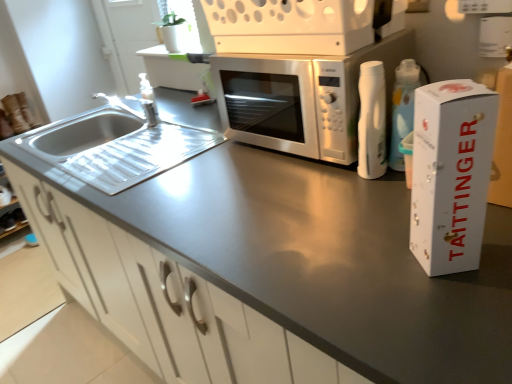
You are a GUI agent. You are given a task and a screenshot of the screen. Output one action in this format:
    pyautogui.click(x=<x>, y=<y>)
    Task: Click on the free spot to the left of satin silver microwave at center
    This screenshot has width=512, height=384.
    Given the screenshot: What is the action you would take?
    pyautogui.click(x=204, y=174)